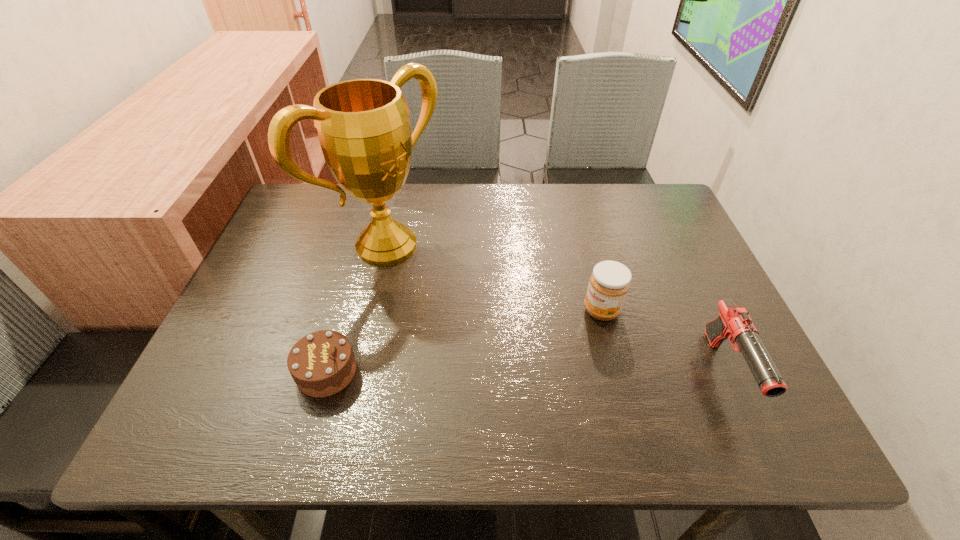
The height and width of the screenshot is (540, 960). I want to click on blank area located on the front label of the third object from left to right, so click(542, 350).

What are the coordinates of `vacant area situated 0.250m on the front label of the third object from left to right` in the screenshot? It's located at (502, 378).

Identify the location of free space located 0.110m on the front label of the third object from left to right. (553, 343).

Identify the location of object at the far edge. (363, 126).

Find the location of a particular element. The height and width of the screenshot is (540, 960). chocolate cake that is at the near edge is located at coordinates (322, 363).

You are a GUI agent. You are given a task and a screenshot of the screen. Output one action in this format:
    pyautogui.click(x=<x>, y=<y>)
    Task: Click on the gun that is at the near edge
    The height and width of the screenshot is (540, 960).
    Given the screenshot: What is the action you would take?
    coord(734,323)

Where is `object located in the right edge section of the desktop`? Image resolution: width=960 pixels, height=540 pixels. object located in the right edge section of the desktop is located at coordinates [x=734, y=323].

Locate an element on the screen. The width and height of the screenshot is (960, 540). object at the near right corner is located at coordinates (734, 323).

This screenshot has height=540, width=960. In the image, there is a desktop. Find the location of `vacant space at the far edge`. vacant space at the far edge is located at coordinates (468, 197).

In the image, there is a desktop. Where is `free space at the near edge`? free space at the near edge is located at coordinates (517, 372).